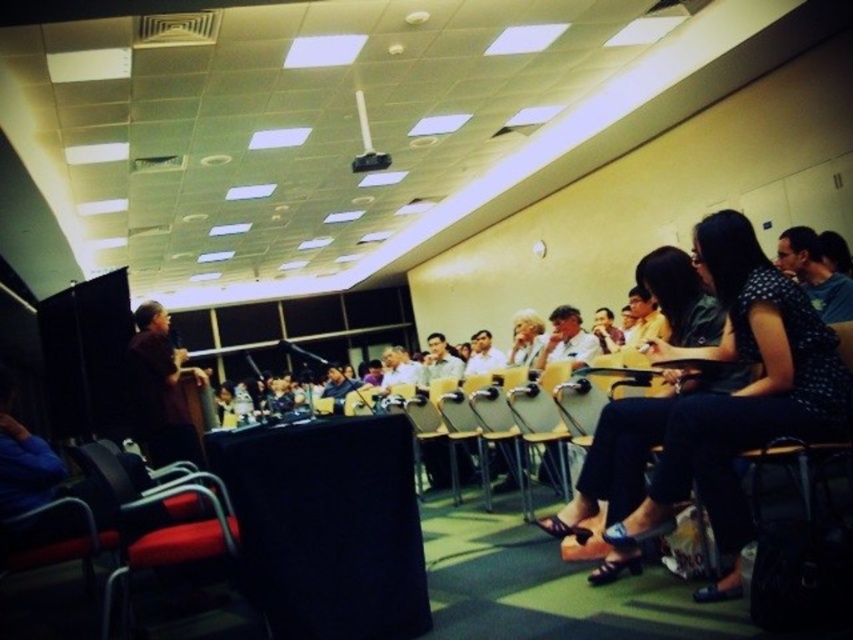
Which is above, red fabric chair at lower left or brown shirt at left?

Positioned higher is brown shirt at left.

Can you confirm if red fabric chair at lower left is positioned below brown shirt at left?

Yes.

The width and height of the screenshot is (853, 640). Describe the element at coordinates (160, 520) in the screenshot. I see `red fabric chair at lower left` at that location.

The image size is (853, 640). Identify the location of red fabric chair at lower left. (160, 520).

Is polka dot blouse at center bigger than red fabric chair at lower left?

Incorrect, polka dot blouse at center is not larger than red fabric chair at lower left.

At what (x,y) coordinates should I click in order to perform the action: click on polka dot blouse at center. Please return your answer as a coordinate pair (x, y). This screenshot has height=640, width=853. Looking at the image, I should click on (741, 392).

Is point (723, 508) in front of point (120, 467)?

Yes, it is.

This screenshot has height=640, width=853. What are the coordinates of `polka dot blouse at center` in the screenshot? It's located at (741, 392).

Does point (703, 397) come behind point (160, 436)?

No, (703, 397) is closer to viewer.

Is polka dot blouse at center closer to the viewer compared to brown shirt at left?

Yes, it is.

Where is `polka dot blouse at center`? This screenshot has height=640, width=853. polka dot blouse at center is located at coordinates (741, 392).